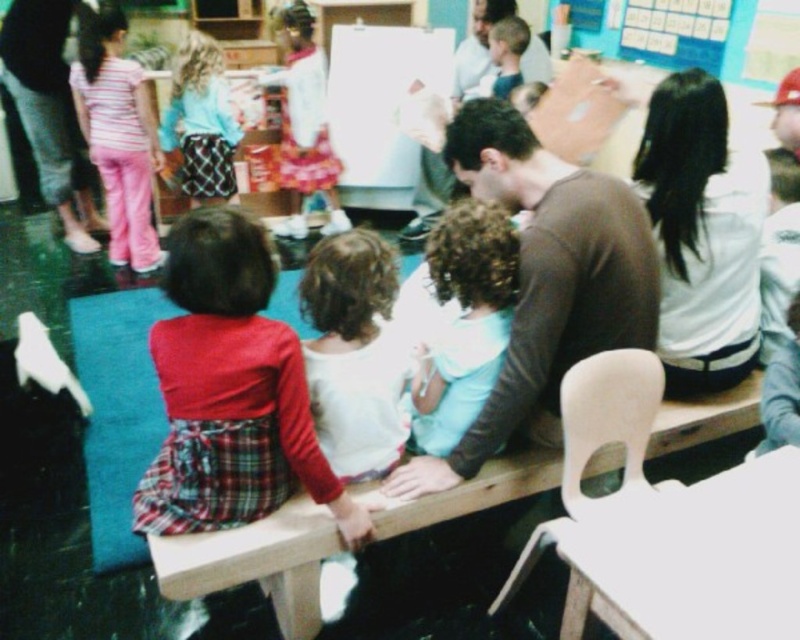
Question: Can you confirm if white matte shirt at center is positioned above striped cotton shirt at upper left?

Choices:
 (A) yes
 (B) no

Answer: (B)

Question: Which object is the closest to the striped cotton shirt at upper left?

Choices:
 (A) brown long-sleeve shirt at center
 (B) blue plaid skirt at center
 (C) blue paperboard at upper center

Answer: (B)

Question: Can you confirm if brown long-sleeve shirt at center is wider than white cotton shirt at upper center?

Choices:
 (A) yes
 (B) no

Answer: (A)

Question: Which object is the farthest from the brown long-sleeve shirt at center?

Choices:
 (A) white cotton shirt at upper center
 (B) blue plaid skirt at center

Answer: (A)

Question: Can you confirm if white cotton shirt at upper center is bigger than blue paperboard at upper center?

Choices:
 (A) yes
 (B) no

Answer: (B)

Question: Which point is farther from the camera taking this photo?

Choices:
 (A) (192, 54)
 (B) (762, 45)
 (C) (521, 317)

Answer: (A)